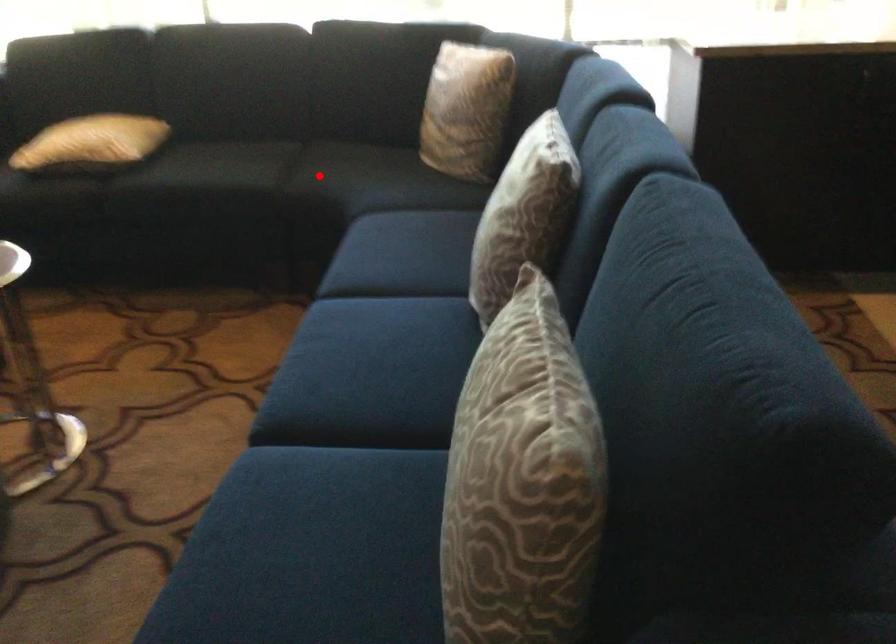
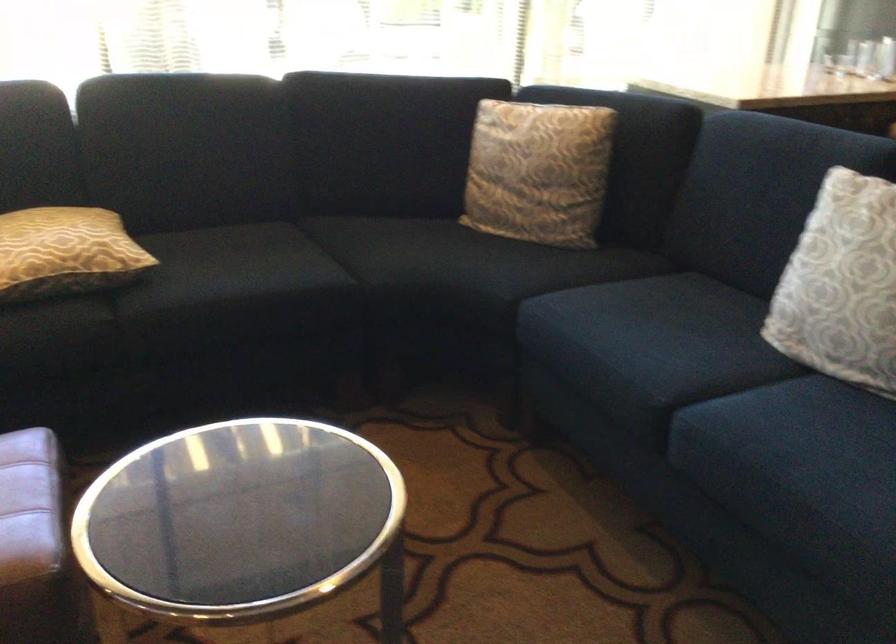
Locate, in the second image, the point that corresponds to the highlighted location in the first image.

(391, 261)